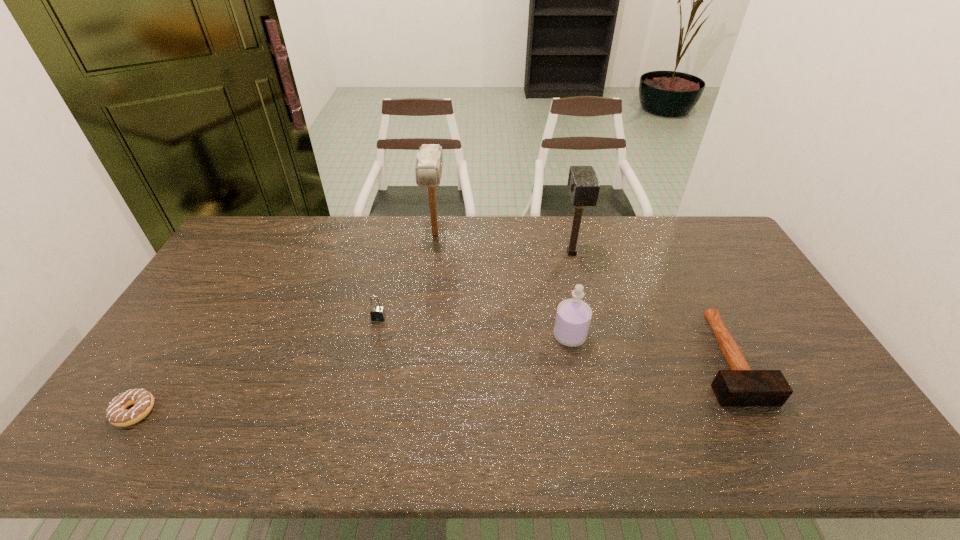
This screenshot has height=540, width=960. What are the coordinates of `free spot located on the front of the second mallet from left to right` in the screenshot? It's located at (588, 319).

The width and height of the screenshot is (960, 540). I want to click on free space located 0.070m on the left of the perfume, so tap(529, 336).

Image resolution: width=960 pixels, height=540 pixels. Identify the location of free space located on the shackle of the third shortest object. (368, 365).

What are the coordinates of `free space located 0.100m on the hammer head face of the rightmost object` in the screenshot? It's located at (771, 445).

Identify the location of vacant region located 0.120m on the right of the doughnut. (203, 411).

The image size is (960, 540). Find the location of `object that is at the near edge`. object that is at the near edge is located at coordinates (117, 413).

The image size is (960, 540). What are the coordinates of `object that is positioned at the left edge` in the screenshot? It's located at (117, 413).

Locate an element on the screen. This screenshot has width=960, height=540. object present at the right edge is located at coordinates 740,386.

The image size is (960, 540). I want to click on object that is at the near left corner, so click(x=117, y=413).

I want to click on free spot at the far edge of the desktop, so click(x=533, y=223).